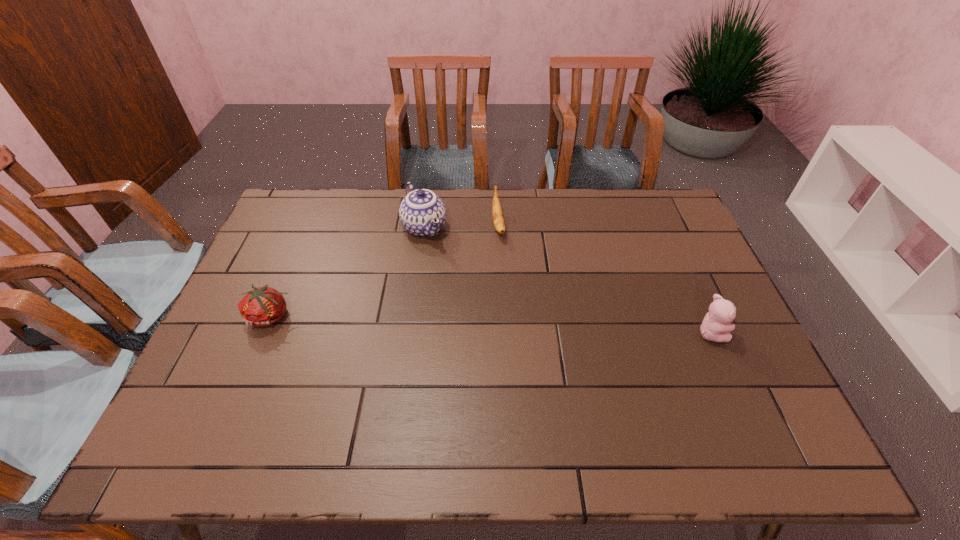
Identify the location of vacant space at the near right corner of the desktop. This screenshot has height=540, width=960. 766,387.

Image resolution: width=960 pixels, height=540 pixels. I want to click on vacant space in between the leftmost object and the rightmost object, so click(491, 324).

Locate an element on the screen. Image resolution: width=960 pixels, height=540 pixels. vacant region between the tallest object and the third object from left to right is located at coordinates (461, 226).

This screenshot has width=960, height=540. Identify the location of free space between the third shortest object and the third object from right to left. (567, 280).

This screenshot has width=960, height=540. Find the location of `free space between the tallest object and the leftmost object`. free space between the tallest object and the leftmost object is located at coordinates pos(348,272).

Image resolution: width=960 pixels, height=540 pixels. In order to click on free space between the leftmost object and the third object from right to left in this screenshot , I will do `click(348, 272)`.

This screenshot has width=960, height=540. In order to click on vacant space in between the leftmost object and the chinaware in this screenshot , I will do `click(348, 272)`.

At what (x,y) coordinates should I click in order to perform the action: click on free space between the banana and the tomato. Please return your answer as a coordinate pair (x, y). The height and width of the screenshot is (540, 960). Looking at the image, I should click on (384, 271).

Where is `vacant space that's between the teddy bear and the tomato`? Image resolution: width=960 pixels, height=540 pixels. vacant space that's between the teddy bear and the tomato is located at coordinates (491, 324).

The image size is (960, 540). In order to click on free point between the rightmost object and the leftmost object in this screenshot , I will do `click(491, 324)`.